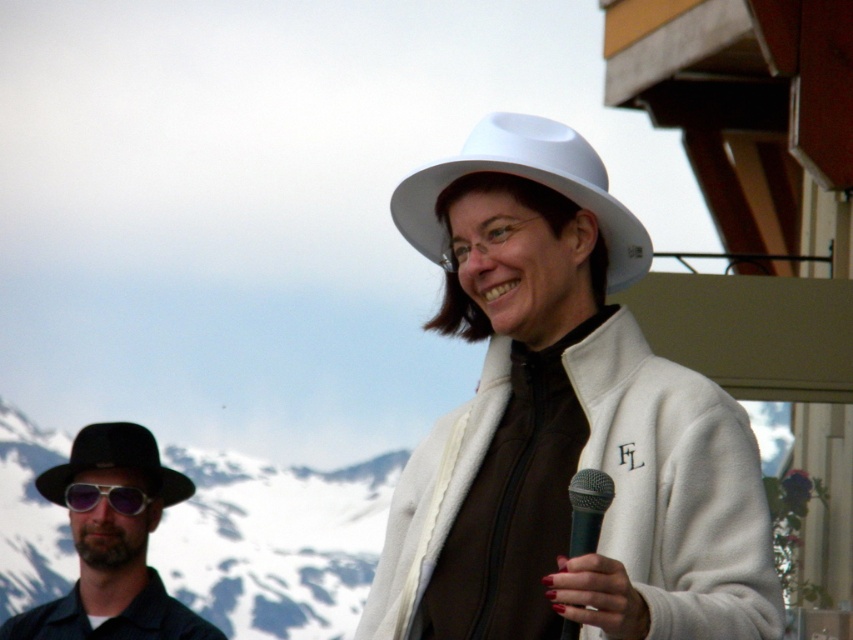
Question: Among these points, which one is farthest from the camera?

Choices:
 (A) (126, 456)
 (B) (606, 483)
 (C) (111, 492)

Answer: (A)

Question: Which object is the farthest from the purple reflective goggles at left?

Choices:
 (A) black felt fedora at left
 (B) snowy mountain at left
 (C) white matte hat at center

Answer: (B)

Question: Does white matte hat at center have a greater width compared to black felt hat at left?

Choices:
 (A) yes
 (B) no

Answer: (A)

Question: Is black felt fedora at left below black metallic microphone at center?

Choices:
 (A) yes
 (B) no

Answer: (A)

Question: Does snowy mountain at left appear under purple reflective goggles at left?

Choices:
 (A) yes
 (B) no

Answer: (A)

Question: Which object appears closest to the camera in this image?

Choices:
 (A) white matte hat at center
 (B) black felt hat at left
 (C) black felt fedora at left
 (D) purple reflective goggles at left

Answer: (A)